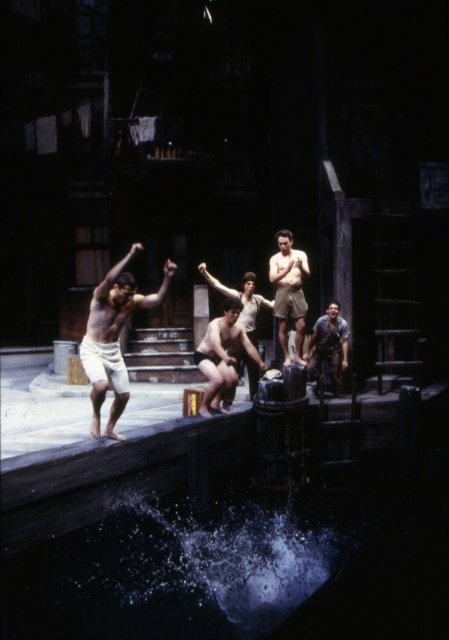
You are a stagehand who needs to place a 10 feet long ladder between the clear liquid water at lower center and the rusty metal man at center. Can you fit the ladder horizontally between them without it touching either object?

The distance between the clear liquid water at lower center and the rusty metal man at center is 9.77 feet, which is shorter than the ladder length of 10 feet. Therefore, the ladder cannot be placed horizontally between them without overlapping or touching the objects.

You are a stagehand who needs to place a 2.5 meter long ladder between the smooth white shorts at center and the smooth beige shorts at center. Can the ladder fit between them without overlapping either?

The smooth white shorts at center and smooth beige shorts at center are 3.05 meters apart. Since the ladder is 2.5 meters long, it can fit between them without overlapping either.

You are an actor in a play standing on the dock. You see the clear liquid water at lower center and the smooth white shorts at center. Which object is located below the other?

The clear liquid water at lower center is positioned under the smooth white shorts at center, so the water is below the shorts.